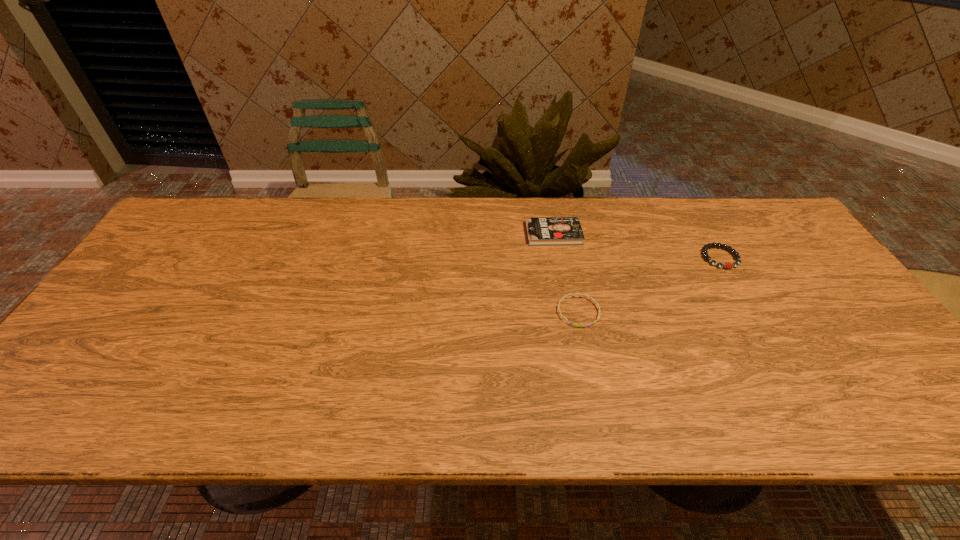
Locate an element on the screen. The image size is (960, 540). vacant space that's between the left bracelet and the rightmost object is located at coordinates (649, 285).

This screenshot has height=540, width=960. I want to click on unoccupied position between the tallest object and the rightmost object, so (636, 246).

The image size is (960, 540). In order to click on free spot between the left bracelet and the tallest object in this screenshot , I will do (565, 273).

In order to click on vacant area that lies between the book and the farther bracelet in this screenshot , I will do tap(636, 246).

The width and height of the screenshot is (960, 540). In order to click on free spot between the nearest object and the tallest object in this screenshot , I will do `click(565, 273)`.

The width and height of the screenshot is (960, 540). Find the location of `the second closest object to the nearest object`. the second closest object to the nearest object is located at coordinates coord(705,255).

Identify which object is located as the nearest to the tallest object. Please provide its 2D coordinates. Your answer should be formatted as a tuple, i.e. [(x, y)], where the tuple contains the x and y coordinates of a point satisfying the conditions above.

[(581, 295)]